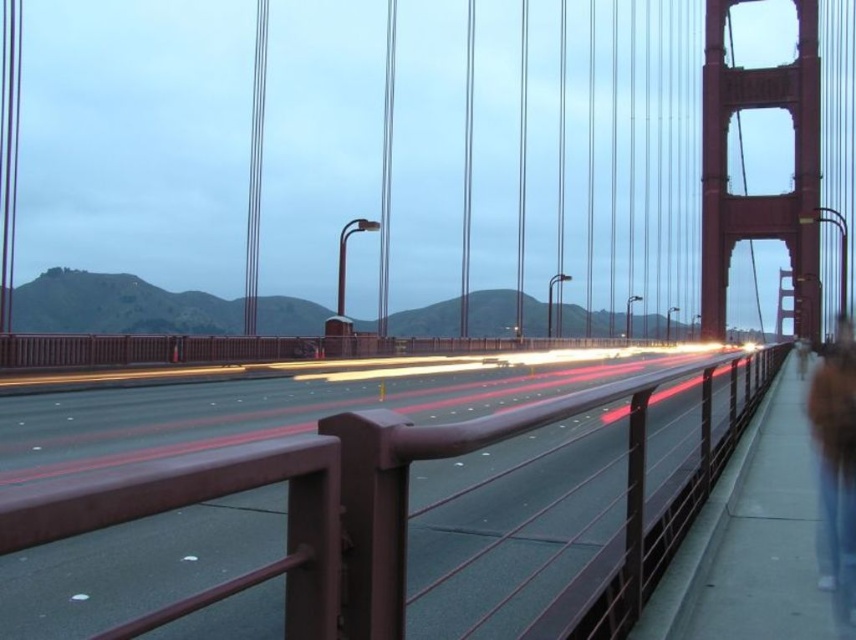
Who is more forward, (462,440) or (829,396)?

Point (462,440) is more forward.

Does brown metal railing at center have a greater height compared to brown fur coat at right?

Yes.

Measure the distance between point (312, 554) and camera.

They are 5.32 feet apart.

Locate an element on the screen. brown metal railing at center is located at coordinates [388, 522].